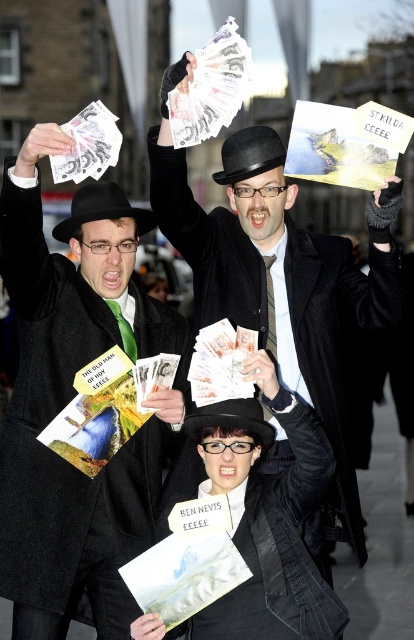
Question: Is matte black coat at upper left positioned before black felt bowler hat at center?

Choices:
 (A) yes
 (B) no

Answer: (A)

Question: Is black felt hat at upper center thinner than black felt bowler hat at center?

Choices:
 (A) no
 (B) yes

Answer: (A)

Question: Which is nearer to the white paper money at center?

Choices:
 (A) black felt hat at center
 (B) matte black coat at center
 (C) matte black coat at upper left
 (D) black felt hat at upper center

Answer: (A)

Question: Which of these objects is positioned farthest from the black felt hat at upper center?

Choices:
 (A) white paper money at center
 (B) black felt bowler hat at center
 (C) matte black coat at center

Answer: (A)

Question: Which object appears farthest from the camera in this image?

Choices:
 (A) black felt hat at center
 (B) black felt bowler hat at center

Answer: (B)

Question: Where is matte black coat at upper left located in relation to black felt hat at center in the image?

Choices:
 (A) above
 (B) below

Answer: (A)